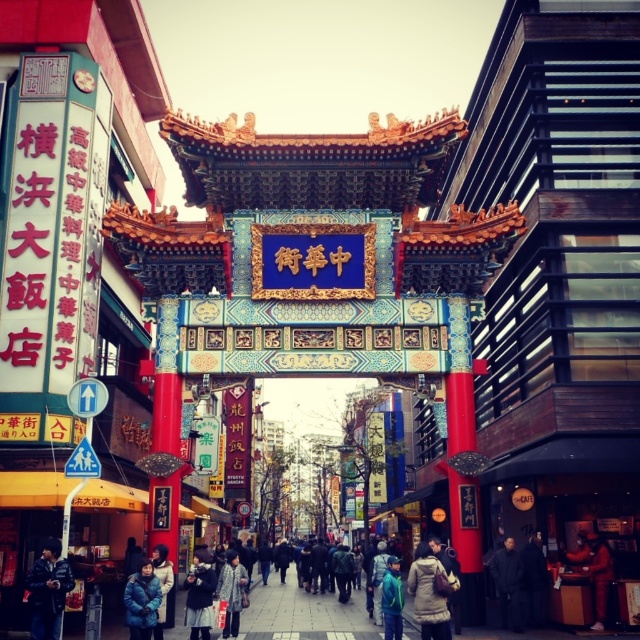
Can you confirm if dark blue jacket at center is positioned to the left of blue fabric jacket at lower center?

No, dark blue jacket at center is not to the left of blue fabric jacket at lower center.

Does dark blue jacket at center have a greater width compared to blue fabric jacket at lower center?

Yes.

Does point (506, 588) come behind point (401, 605)?

Yes, point (506, 588) is behind point (401, 605).

Where is `dark blue jacket at center`? The width and height of the screenshot is (640, 640). dark blue jacket at center is located at coordinates pyautogui.click(x=508, y=582).

In the scene shown: Can you confirm if concrete sidewalk at center is shorter than matte brown coat at center?

No.

What are the coordinates of `concrete sidewalk at center` in the screenshot? It's located at (304, 614).

Identify the location of concrete sidewalk at center. (304, 614).

Can you confirm if concrete sidewalk at center is smaller than dark blue jacket at lower left?

Incorrect, concrete sidewalk at center is not smaller in size than dark blue jacket at lower left.

Based on the photo, who is taller, concrete sidewalk at center or dark blue jacket at lower left?

Standing taller between the two is concrete sidewalk at center.

Is point (272, 586) positioned before point (60, 547)?

That is False.

Identify the location of concrete sidewalk at center. (304, 614).